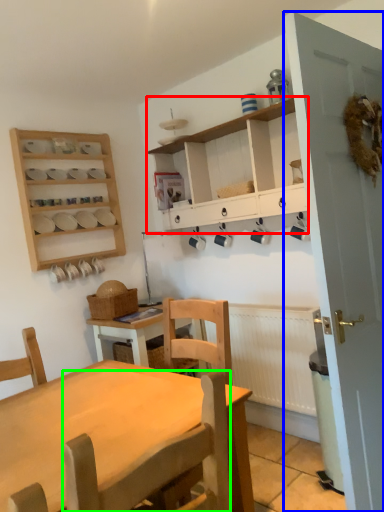
Question: Estimate the real-world distances between objects in this image. Which object is closer to cabinetry (highlighted by a red box), door (highlighted by a blue box) or chair (highlighted by a green box)?

Choices:
 (A) door
 (B) chair

Answer: (A)